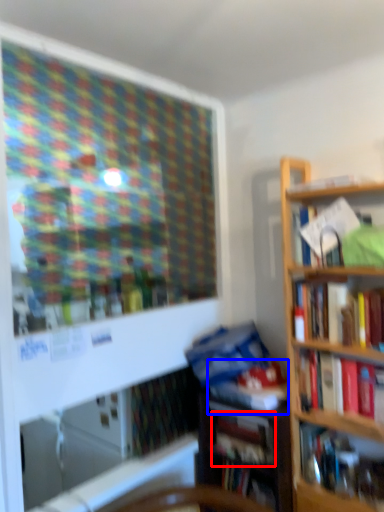
Question: Which of the following is the farthest to the observer, book (highlighted by a red box) or book (highlighted by a blue box)?

Choices:
 (A) book
 (B) book

Answer: (A)